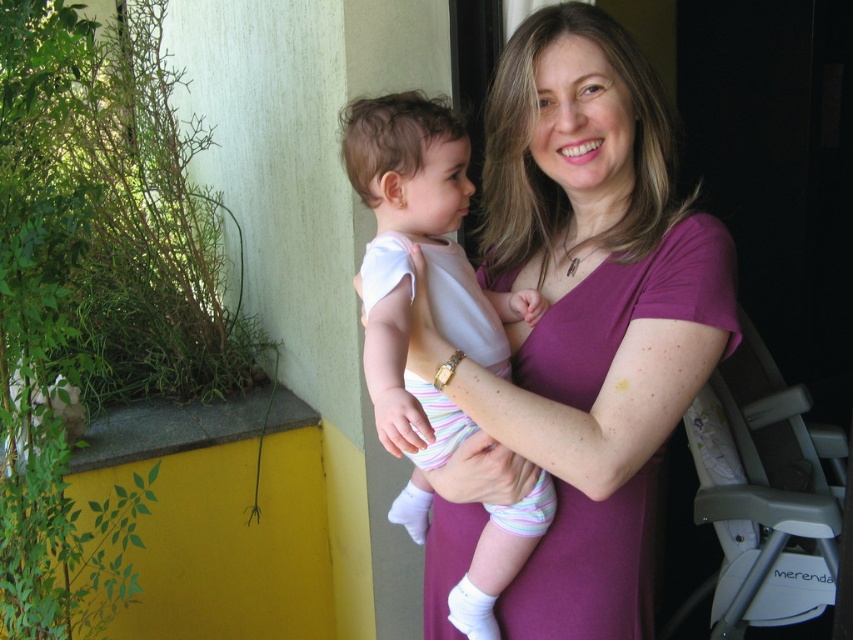
The woman is wearing a purple smooth shirt at center, and the baby is wearing a white cotton onesie at center. Which clothing item has a greater width?

The purple smooth shirt at center has a greater width than the white cotton onesie at center according to the description.

You are a photographer taking a picture of the purple smooth shirt at center and the white cotton onesie at center. Which one is closer to the camera?

The purple smooth shirt at center is closer to the camera because the white cotton onesie at center is behind it.